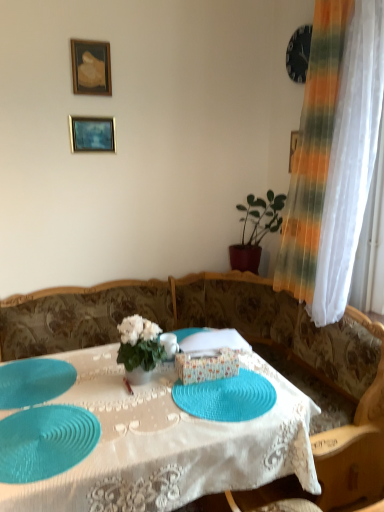
At what (x,y) coordinates should I click in order to perform the action: click on vacant space to the right of teal rubber placemat at lower left, acting as the third glass plate starting from the right. Please return your answer as a coordinate pair (x, y). Looking at the image, I should click on (105, 397).